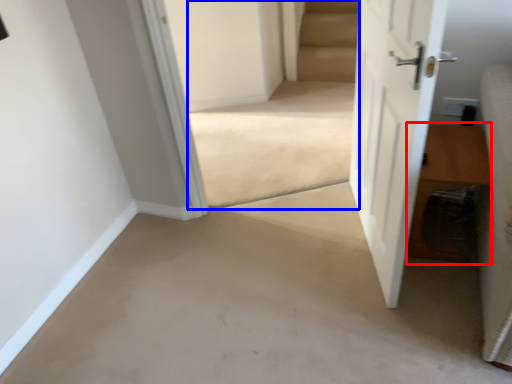
Question: Which of the following is the farthest to the observer, hardwood (highlighted by a red box) or stairwell (highlighted by a blue box)?

Choices:
 (A) hardwood
 (B) stairwell

Answer: (B)